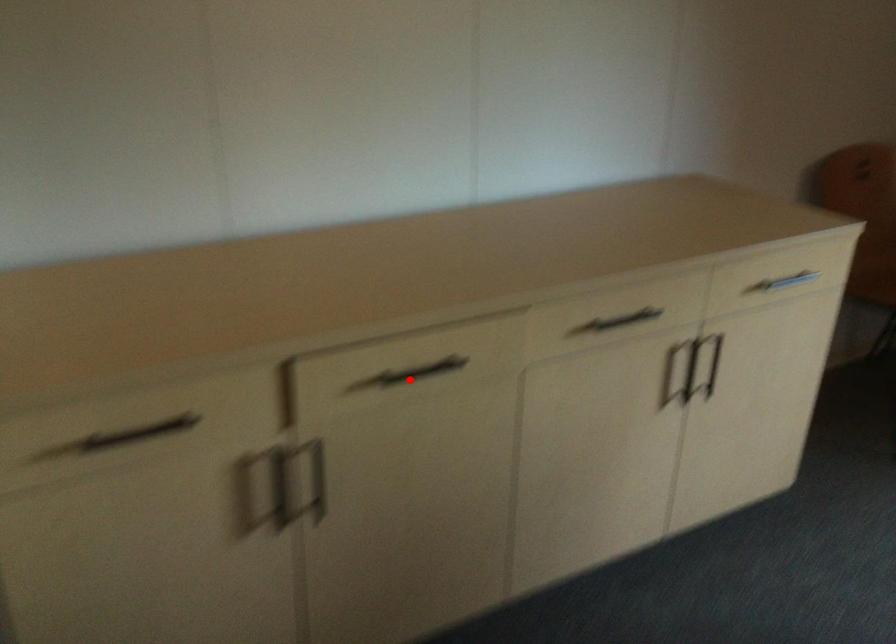
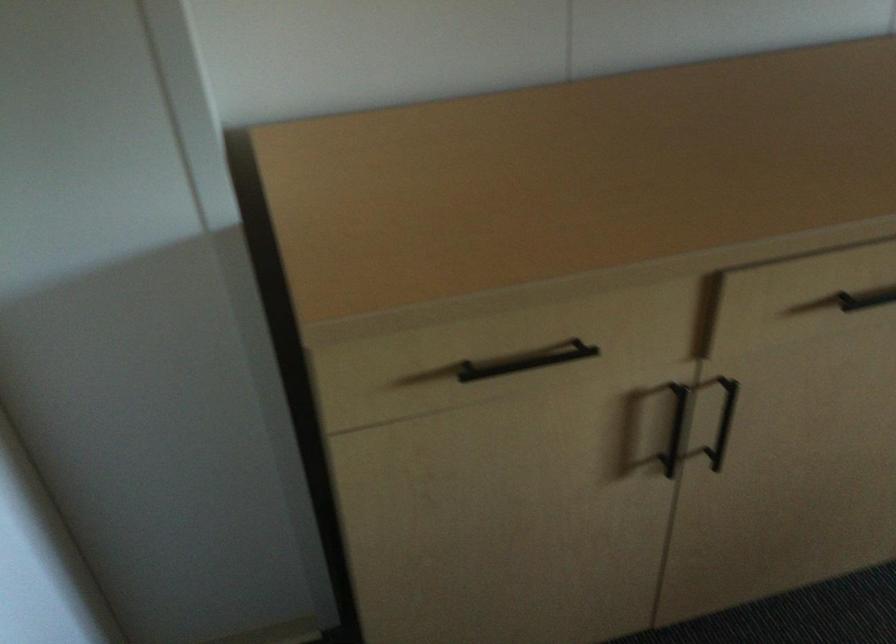
Question: I am providing you with two images of the same scene from different viewpoints. In image1, a red point is highlighted. Considering the same 3D point in image2, which of the following is correct?

Choices:
 (A) It is closer
 (B) It is farther

Answer: (A)